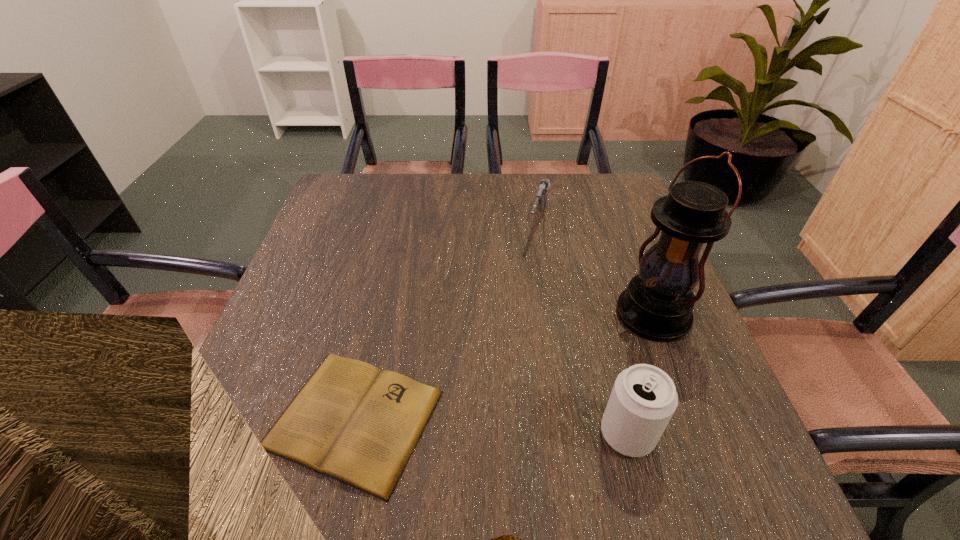
Identify the location of free spot on the desktop that is between the shortest object and the can and is positioned above the tallest object, indicating its light source. (453, 424).

Locate an element on the screen. The image size is (960, 540). free space on the desktop that is between the leftmost object and the third shortest object and is positioned at the barrel of the third object from right to left is located at coordinates (468, 425).